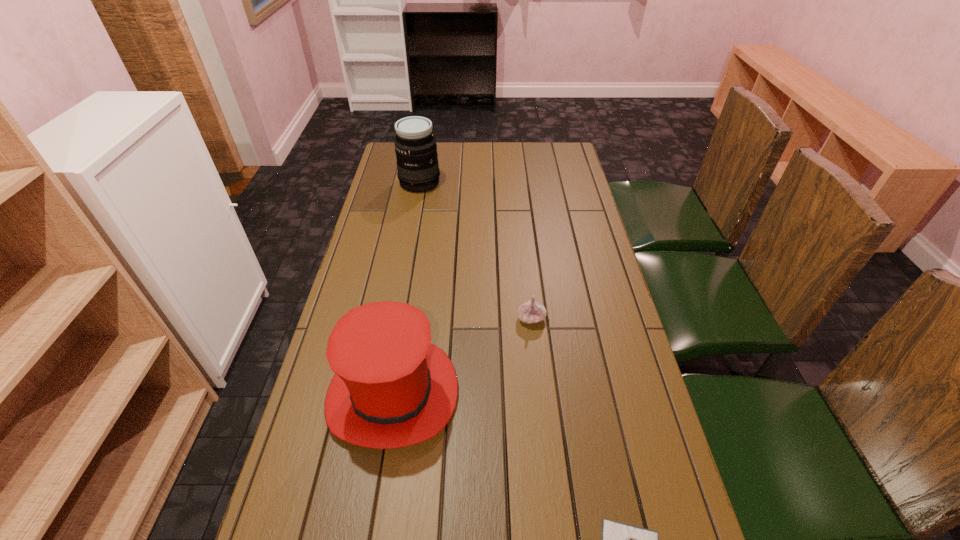
Identify the location of blank space at the left edge. Image resolution: width=960 pixels, height=540 pixels. (353, 454).

I want to click on vacant region at the right edge, so click(x=575, y=172).

This screenshot has height=540, width=960. In order to click on empty space between the hat and the third tallest object in this screenshot , I will do [x=463, y=355].

Identify which object is the nearest to the left garlic. Please provide its 2D coordinates. Your answer should be formatted as a tuple, i.e. [(x, y)], where the tuple contains the x and y coordinates of a point satisfying the conditions above.

[(392, 388)]

I want to click on the third closest object to the shortest object, so click(x=415, y=146).